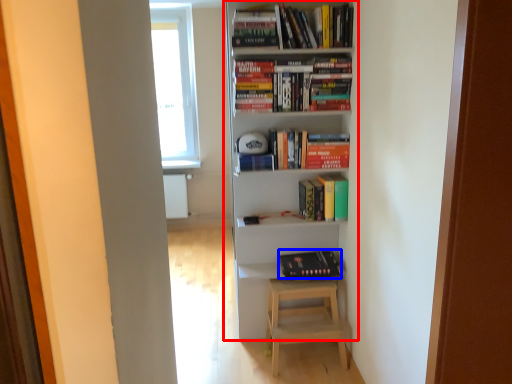
Question: Which point is closer to the camera, bookcase (highlighted by a red box) or book (highlighted by a blue box)?

Choices:
 (A) bookcase
 (B) book

Answer: (A)